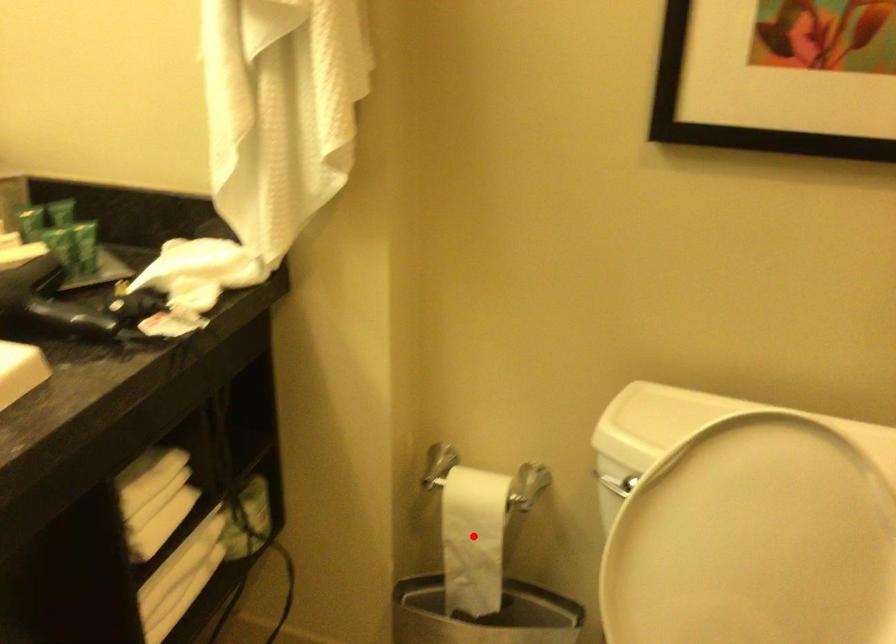
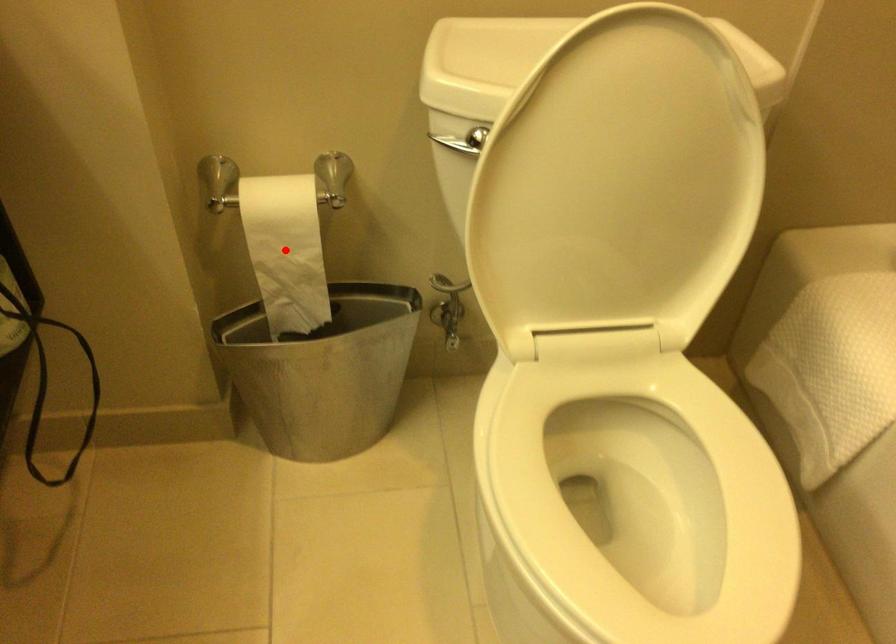
I am providing you with two images of the same scene from different viewpoints. A red point is marked on the first image and another point is marked on the second image. Does the point marked in image1 correspond to the same location as the one in image2?

Yes